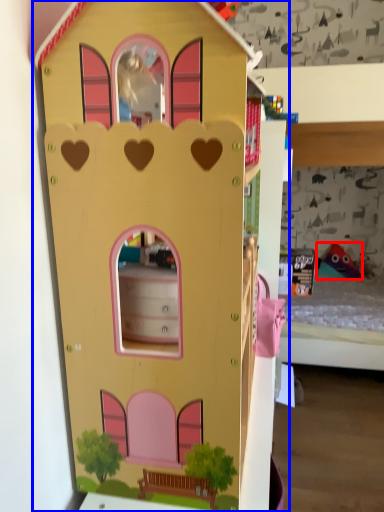
Question: Which object is closer to the camera taking this photo, toy (highlighted by a red box) or toy (highlighted by a blue box)?

Choices:
 (A) toy
 (B) toy

Answer: (B)